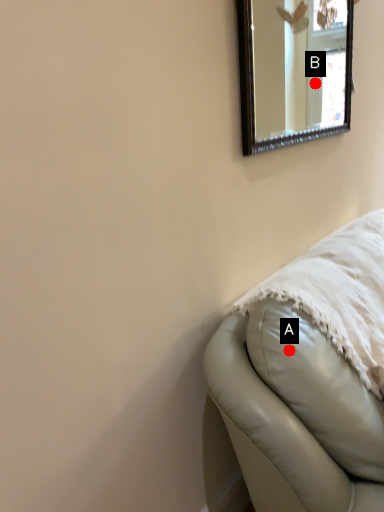
Question: Two points are circled on the image, labeled by A and B beside each circle. Which point appears farthest from the camera in this image?

Choices:
 (A) A is further
 (B) B is further

Answer: (B)